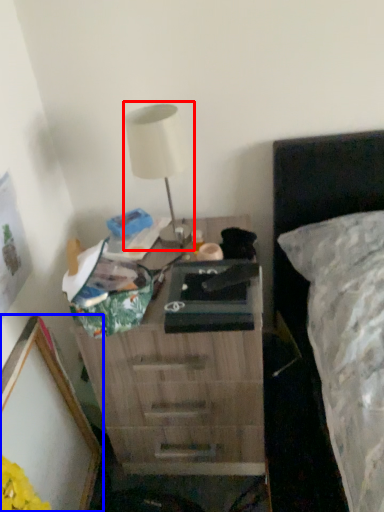
Question: Among these objects, which one is farthest to the camera, table lamp (highlighted by a red box) or picture frame (highlighted by a blue box)?

Choices:
 (A) table lamp
 (B) picture frame

Answer: (A)